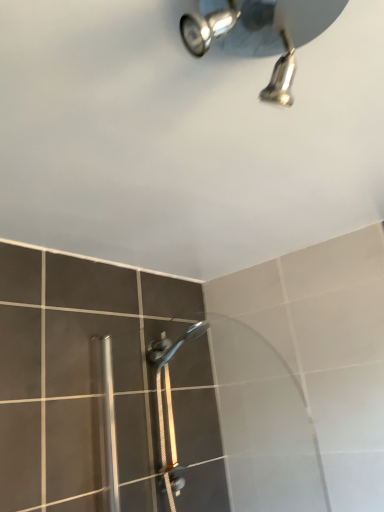
Question: In which direction should I rotate to look at polished chrome shower head at upper center?

Choices:
 (A) left
 (B) right

Answer: (B)